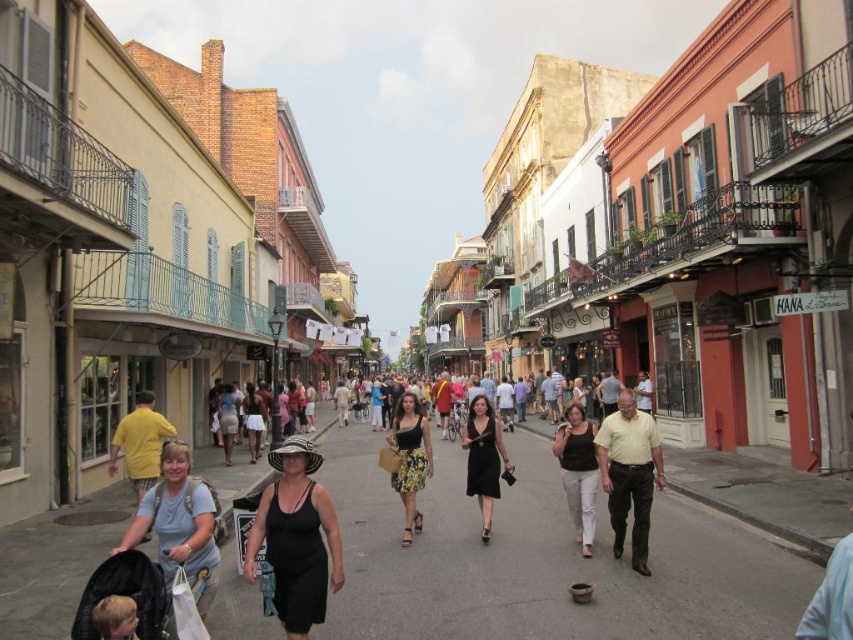
Question: Which of the following is the farthest from the observer?

Choices:
 (A) (293, 508)
 (B) (28, 632)

Answer: (B)

Question: Is black matte dress at center bigger than floral skirt at center?

Choices:
 (A) yes
 (B) no

Answer: (A)

Question: Among these points, which one is nearest to the camera?

Choices:
 (A) (248, 561)
 (B) (96, 627)

Answer: (B)

Question: Does dark brown textured dress at center have a greater width compared to blonde hair at lower left?

Choices:
 (A) yes
 (B) no

Answer: (A)

Question: Which point is farther to the camera?

Choices:
 (A) (590, 529)
 (B) (141, 502)
 (C) (643, 451)

Answer: (A)

Question: Does dark brown textured dress at center have a lesser width compared to black dress at center?

Choices:
 (A) yes
 (B) no

Answer: (B)